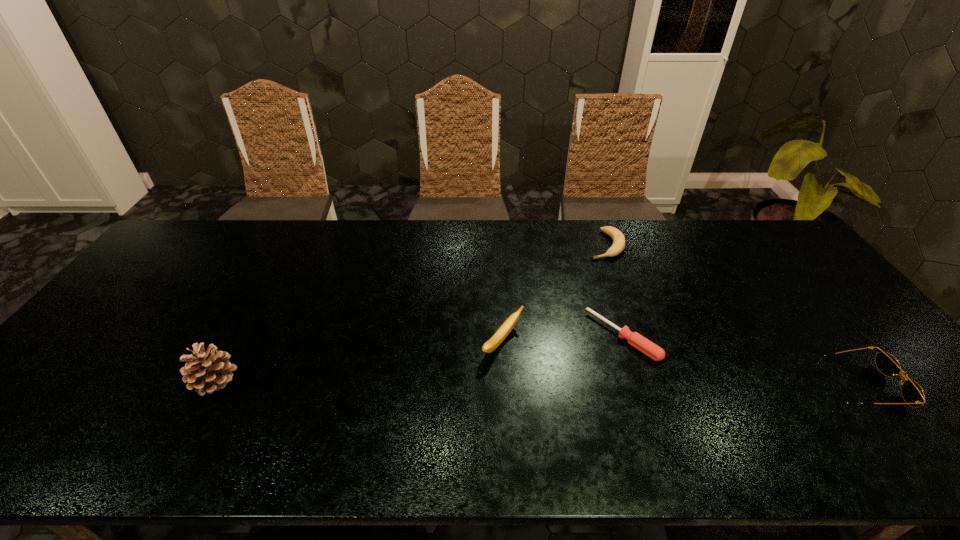
This screenshot has height=540, width=960. Find the location of `vacant space situated at the stem of the right banana`. vacant space situated at the stem of the right banana is located at coordinates (597, 307).

The image size is (960, 540). I want to click on vacant space located 0.050m at the stem of the right banana, so click(x=603, y=269).

I want to click on free location located at the stem of the right banana, so click(602, 277).

Find the location of `free location located 0.280m at the tip of the shortest object`. free location located 0.280m at the tip of the shortest object is located at coordinates (530, 420).

The image size is (960, 540). What are the coordinates of `free region located at the tip of the shortest object` in the screenshot? It's located at click(592, 365).

The image size is (960, 540). Find the location of `free region located 0.050m at the tip of the shortest object`. free region located 0.050m at the tip of the shortest object is located at coordinates (592, 365).

Where is `free point located 0.270m at the stem of the second object from left to right`? The height and width of the screenshot is (540, 960). free point located 0.270m at the stem of the second object from left to right is located at coordinates (626, 400).

Where is `vacant space located 0.330m at the stem of the second object from left to right`? vacant space located 0.330m at the stem of the second object from left to right is located at coordinates (651, 411).

Locate an element on the screen. free space located 0.270m at the stem of the second object from left to right is located at coordinates (626, 400).

What are the coordinates of `object present at the far edge` in the screenshot? It's located at (618, 245).